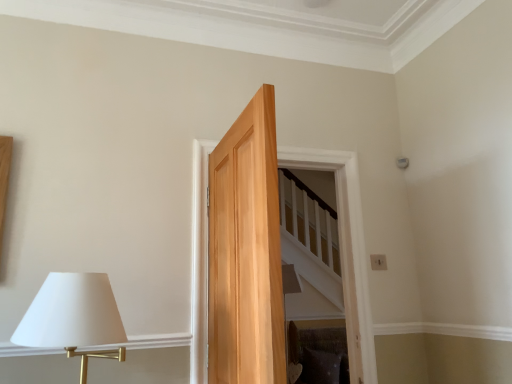
The image size is (512, 384). Describe the element at coordinates (346, 250) in the screenshot. I see `natural wood door at center` at that location.

In order to face natural wood door at center, should I rotate leftwards or rightwards?

To face it directly, rotate right by 4.114 degrees.

Where is `natural wood door at center`? Image resolution: width=512 pixels, height=384 pixels. natural wood door at center is located at coordinates [x=346, y=250].

Where is `natural wood door at center`? Image resolution: width=512 pixels, height=384 pixels. natural wood door at center is located at coordinates (346, 250).